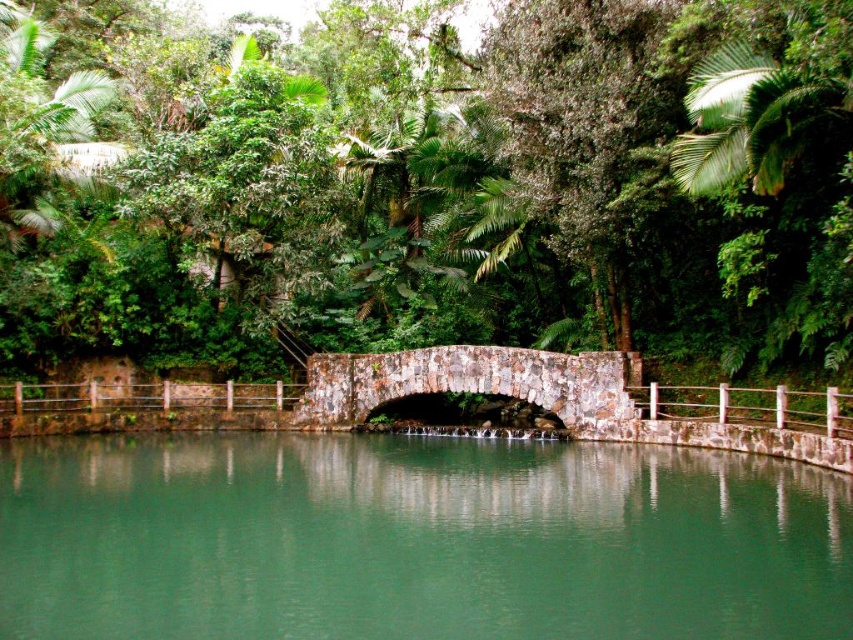
Question: Considering the real-world distances, which object is farthest from the green leafy tree at upper right?

Choices:
 (A) green stone river at center
 (B) rustic stone bridge at center

Answer: (A)

Question: Does green stone river at center appear on the left side of green leafy tree at upper right?

Choices:
 (A) yes
 (B) no

Answer: (A)

Question: Is green stone river at center below rustic stone bridge at center?

Choices:
 (A) yes
 (B) no

Answer: (A)

Question: Is green leafy tree at center above rustic stone bridge at center?

Choices:
 (A) yes
 (B) no

Answer: (A)

Question: Which point appears farthest from the camera in this image?

Choices:
 (A) (527, 449)
 (B) (773, 236)
 (C) (178, 196)

Answer: (C)

Question: Which point is farther from the camera taking this photo?

Choices:
 (A) 190,472
 (B) 769,342

Answer: (B)